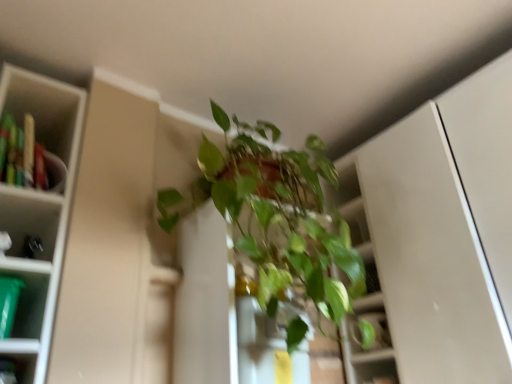
Question: Is green plastic container at left behind green glossy plant at center?

Choices:
 (A) no
 (B) yes

Answer: (B)

Question: From a real-world perspective, is green plastic container at left located higher than green glossy plant at center?

Choices:
 (A) no
 (B) yes

Answer: (B)

Question: From a real-world perspective, is green plastic container at left beneath green glossy plant at center?

Choices:
 (A) yes
 (B) no

Answer: (B)

Question: Is the depth of green plastic container at left less than that of green glossy plant at center?

Choices:
 (A) yes
 (B) no

Answer: (B)

Question: Is green plastic container at left oriented away from green glossy plant at center?

Choices:
 (A) yes
 (B) no

Answer: (B)

Question: Is green plastic container at left shorter than green glossy plant at center?

Choices:
 (A) yes
 (B) no

Answer: (A)

Question: Is green plastic container at left touching green plastic container at left?

Choices:
 (A) no
 (B) yes

Answer: (A)

Question: Is green plastic container at left positioned in front of green plastic container at left?

Choices:
 (A) no
 (B) yes

Answer: (A)

Question: Would you say green plastic container at left contains green plastic container at left?

Choices:
 (A) no
 (B) yes

Answer: (A)

Question: Does green plastic container at left have a greater height compared to green plastic container at left?

Choices:
 (A) no
 (B) yes

Answer: (B)

Question: Would you say green plastic container at left is a long distance from green plastic container at left?

Choices:
 (A) yes
 (B) no

Answer: (B)

Question: Does green plastic container at left come behind green plastic container at left?

Choices:
 (A) no
 (B) yes

Answer: (B)

Question: Is green plastic container at left closer to the viewer compared to green plastic container at left?

Choices:
 (A) yes
 (B) no

Answer: (A)